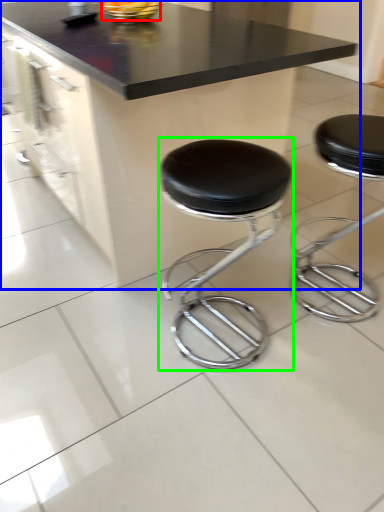
Question: Which object is positioned closest to food (highlighted by a red box)? Select from table (highlighted by a blue box) and stool (highlighted by a green box).

Choices:
 (A) table
 (B) stool

Answer: (A)